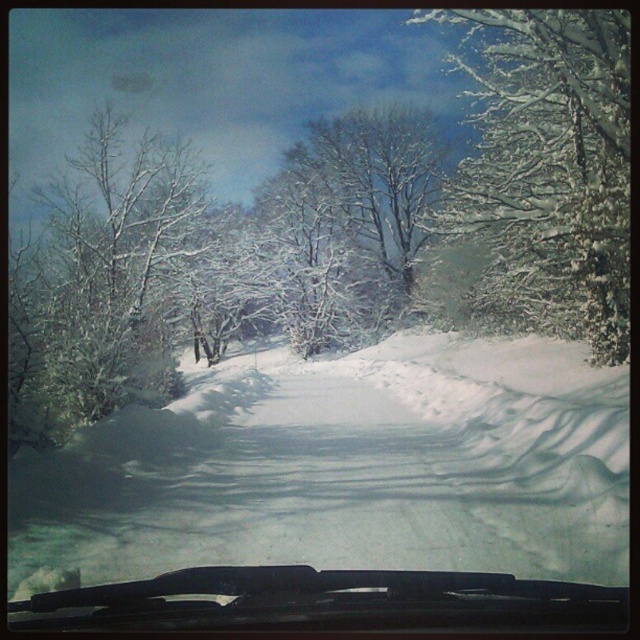
Question: Which of these objects is positioned farthest from the white frosty tree at center?

Choices:
 (A) white fluffy snow at center
 (B) white snow-covered tree at right
 (C) white snow-covered tree at left

Answer: (A)

Question: Which of the following is the closest to the observer?

Choices:
 (A) white snow-covered tree at right
 (B) transparent glass windshield at center

Answer: (B)

Question: Among these points, which one is nearest to the camera?

Choices:
 (A) (387, 305)
 (B) (625, 416)
 (C) (150, 209)

Answer: (B)

Question: Considering the relative positions of white snow-covered tree at right and transparent glass windshield at center in the image provided, where is white snow-covered tree at right located with respect to transparent glass windshield at center?

Choices:
 (A) left
 (B) right

Answer: (B)

Question: Observing the image, what is the correct spatial positioning of white fluffy snow at center in reference to white snow-covered tree at left?

Choices:
 (A) above
 (B) below

Answer: (B)

Question: Does white snow-covered tree at right appear under transparent glass windshield at center?

Choices:
 (A) no
 (B) yes

Answer: (A)